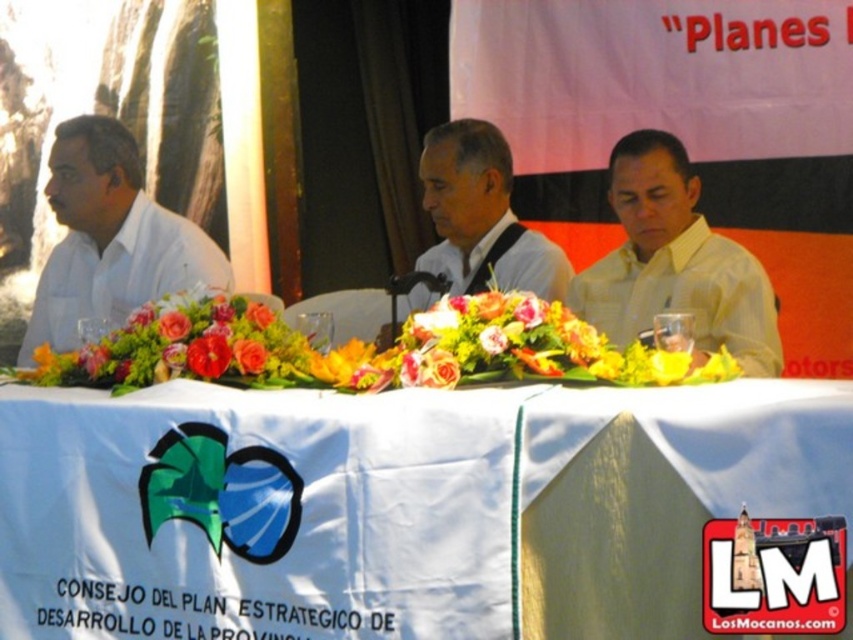
Question: Which object is positioned closest to the white matte shirt at left?

Choices:
 (A) white matte shirt at center
 (B) white cloth at center
 (C) yellow textured shirt at center

Answer: (A)

Question: Which of the following is the farthest from the observer?

Choices:
 (A) white cloth at center
 (B) white matte shirt at center
 (C) white matte shirt at left

Answer: (C)

Question: Does white matte shirt at left have a greater width compared to white matte shirt at center?

Choices:
 (A) no
 (B) yes

Answer: (B)

Question: Does white matte shirt at left appear over white matte shirt at center?

Choices:
 (A) no
 (B) yes

Answer: (A)

Question: Which of the following is the farthest from the observer?

Choices:
 (A) white matte shirt at left
 (B) yellow textured shirt at center
 (C) white cloth at center
 (D) white matte shirt at center

Answer: (A)

Question: Does white cloth at center lie behind white matte shirt at left?

Choices:
 (A) yes
 (B) no

Answer: (B)